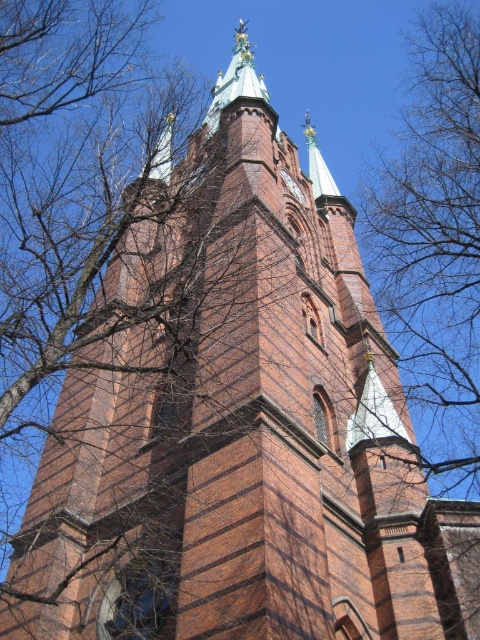
Question: Is bare branches at upper right thinner than polished brass clock at upper center?

Choices:
 (A) yes
 (B) no

Answer: (B)

Question: Does bare branches at upper right appear on the left side of polished brass clock at upper center?

Choices:
 (A) no
 (B) yes

Answer: (A)

Question: Which point is farther to the camera?

Choices:
 (A) polished brass clock at upper center
 (B) bare branches at upper right

Answer: (A)

Question: Observing the image, what is the correct spatial positioning of bare branches at upper right in reference to polished brass clock at upper center?

Choices:
 (A) left
 (B) right

Answer: (B)